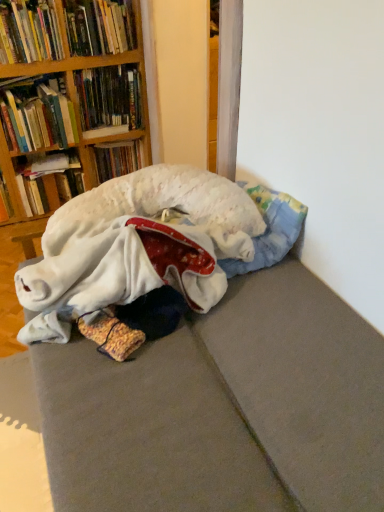
Question: Is hardcover book at left, the first book positioned from the bottom, wider or thinner than washed fabric bed at lower left?

Choices:
 (A) wide
 (B) thin

Answer: (B)

Question: Is hardcover book at left, acting as the seventh book starting from the top, bigger or smaller than washed fabric bed at lower left?

Choices:
 (A) big
 (B) small

Answer: (B)

Question: Based on their relative distances, which object is nearer to the hardcover book at upper left, the fourth book from the bottom?

Choices:
 (A) hardcover book at upper left, placed as the second book when sorted from bottom to top
 (B) hardcover books at upper left, acting as the fifth book starting from the bottom
 (C) washed fabric bed at lower left
 (D) white fluffy dog at center
 (E) hardcover book at left, acting as the seventh book starting from the top

Answer: (A)

Question: Which of these objects is positioned closest to the hardcover book at upper left, the fourth book when ordered from top to bottom?

Choices:
 (A) hardcover books at upper left, acting as the fifth book starting from the bottom
 (B) hardcover book at upper left, placed as the sixth book when sorted from bottom to top
 (C) washed fabric bed at lower left
 (D) hardcover book at left, the first book positioned from the bottom
 (E) white fluffy dog at center

Answer: (D)